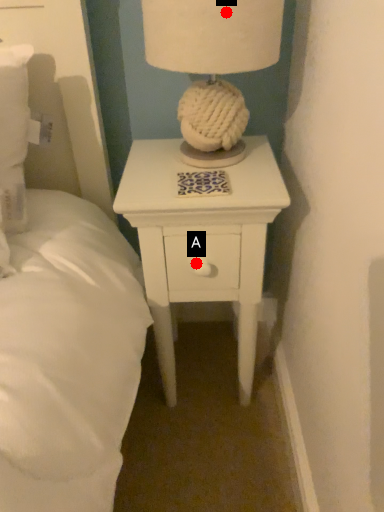
Question: Two points are circled on the image, labeled by A and B beside each circle. Which point appears farthest from the camera in this image?

Choices:
 (A) A is further
 (B) B is further

Answer: (A)